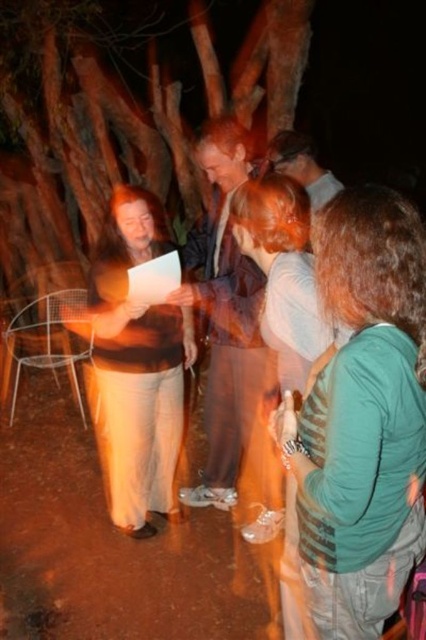
Question: Which is farther from the light brown leather jacket at center?

Choices:
 (A) brown wood tree at upper center
 (B) green striped shirt at center
 (C) matte brown shirt at upper center
 (D) brown matte shirt at center

Answer: (A)

Question: Where is brown wood tree at upper center located in relation to matte brown shirt at upper center in the image?

Choices:
 (A) above
 (B) below

Answer: (A)

Question: Which of these objects is positioned closest to the light brown leather jacket at center?

Choices:
 (A) brown wood tree at upper center
 (B) matte brown shirt at upper center

Answer: (B)

Question: In this image, where is brown matte shirt at center located relative to matte brown shirt at upper center?

Choices:
 (A) above
 (B) below

Answer: (B)

Question: Among these objects, which one is farthest from the camera?

Choices:
 (A) brown wood tree at upper center
 (B) green striped shirt at center
 (C) light brown leather jacket at center
 (D) brown matte shirt at center

Answer: (A)

Question: Does brown matte shirt at center come in front of light brown leather jacket at center?

Choices:
 (A) yes
 (B) no

Answer: (A)